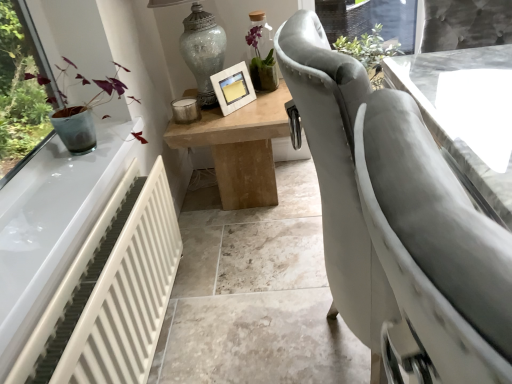
Find the location of a particular element. The width and height of the screenshot is (512, 384). white glossy table at center, positioned as the 2th table in left-to-right order is located at coordinates (447, 135).

What do you see at coordinates (233, 88) in the screenshot? The height and width of the screenshot is (384, 512). I see `white textured picture frame at center` at bounding box center [233, 88].

This screenshot has height=384, width=512. Describe the element at coordinates (203, 51) in the screenshot. I see `crackle glass vase at upper center` at that location.

What is the approximate height of crackle glass vase at upper center?

crackle glass vase at upper center is 20.92 inches in height.

At what (x,y) coordinates should I click in order to perform the action: click on light brown wooden table at center, which is the first table from left to right. Please return your answer as a coordinate pair (x, y). Looking at the image, I should click on (240, 147).

Could you tell me if white glossy table at center, positioned as the 2th table in left-to-right order, is facing crackle glass vase at upper center?

No, white glossy table at center, positioned as the 2th table in left-to-right order, is not oriented towards crackle glass vase at upper center.

Which object is closer to the camera, white glossy table at center, arranged as the first table when viewed from the right, or crackle glass vase at upper center?

white glossy table at center, arranged as the first table when viewed from the right.

Which of these two, white glossy table at center, positioned as the 2th table in left-to-right order, or crackle glass vase at upper center, is smaller?

With smaller size is crackle glass vase at upper center.

Based on the photo, from a real-world perspective, which is physically below, white glossy table at center, positioned as the 2th table in left-to-right order, or crackle glass vase at upper center?

white glossy table at center, positioned as the 2th table in left-to-right order, from a real-world perspective.

From the picture: Is the position of white glossy table at center, positioned as the 2th table in left-to-right order, more distant than that of white textured picture frame at center?

No.

Which of these two, white glossy table at center, positioned as the 2th table in left-to-right order, or white textured picture frame at center, is thinner?

white textured picture frame at center is thinner.

Is point (454, 152) positioned behind point (245, 74)?

That is False.

From the image's perspective, is white glossy table at center, positioned as the 2th table in left-to-right order, positioned above or below white textured picture frame at center?

white glossy table at center, positioned as the 2th table in left-to-right order, is situated lower than white textured picture frame at center in the image.

In the scene shown: From a real-world perspective, is white glossy table at center, positioned as the 2th table in left-to-right order, above or below white matte radiator at lower left?

Clearly, from a real-world perspective, white glossy table at center, positioned as the 2th table in left-to-right order, is above white matte radiator at lower left.

The image size is (512, 384). In order to click on radiator directly beneath the white glossy table at center, arranged as the first table when viewed from the right (from a real-world perspective) in this screenshot , I will do `click(111, 294)`.

Looking at this image, is white glossy table at center, positioned as the 2th table in left-to-right order, turned away from white matte radiator at lower left?

No, white glossy table at center, positioned as the 2th table in left-to-right order, is not facing the opposite direction of white matte radiator at lower left.

Is white glossy table at center, positioned as the 2th table in left-to-right order, directly adjacent to white matte radiator at lower left?

No, white glossy table at center, positioned as the 2th table in left-to-right order, is not beside white matte radiator at lower left.

Considering the relative positions of white textured picture frame at center and light brown wooden table at center, which is the first table from left to right, in the image provided, is white textured picture frame at center to the left or to the right of light brown wooden table at center, which is the first table from left to right,?

Clearly, white textured picture frame at center is on the left of light brown wooden table at center, which is the first table from left to right, in the image.

Does white textured picture frame at center contain light brown wooden table at center, which is the first table from left to right?

No, light brown wooden table at center, which is the first table from left to right, is not a part of white textured picture frame at center.

Does point (255, 94) come in front of point (217, 107)?

No, (255, 94) is further to viewer.

Is white matte radiator at lower left not within white textured picture frame at center?

Indeed, white matte radiator at lower left is completely outside white textured picture frame at center.

Locate an element on the screen. This screenshot has height=384, width=512. picture frame that is above the white matte radiator at lower left (from the image's perspective) is located at coordinates (233, 88).

Is white matte radiator at lower left further to the viewer compared to white textured picture frame at center?

No, white matte radiator at lower left is closer to the viewer.

In terms of size, does white matte radiator at lower left appear bigger or smaller than white textured picture frame at center?

Clearly, white matte radiator at lower left is larger in size than white textured picture frame at center.

How many degrees apart are the facing directions of white textured picture frame at center and crackle glass vase at upper center?

36 degrees separate the facing orientations of white textured picture frame at center and crackle glass vase at upper center.

From a real-world perspective, between white textured picture frame at center and crackle glass vase at upper center, who is vertically lower?

white textured picture frame at center.

How much distance is there between white textured picture frame at center and crackle glass vase at upper center?

white textured picture frame at center is 5.31 inches away from crackle glass vase at upper center.

Is white textured picture frame at center looking in the opposite direction of crackle glass vase at upper center?

Yes.

In terms of height, does white glossy table at center, positioned as the 2th table in left-to-right order, look taller or shorter compared to light brown wooden table at center, which is the first table from left to right?

Considering their sizes, white glossy table at center, positioned as the 2th table in left-to-right order, has more height than light brown wooden table at center, which is the first table from left to right.

From a real-world perspective, who is located lower, white glossy table at center, positioned as the 2th table in left-to-right order, or light brown wooden table at center, which is the first table from left to right?

From a 3D spatial view, light brown wooden table at center, which is the first table from left to right, is below.

Can you confirm if white glossy table at center, positioned as the 2th table in left-to-right order, is bigger than light brown wooden table at center, placed as the 2th table when sorted from right to left?

Yes.

Does white glossy table at center, arranged as the first table when viewed from the right, have a greater width compared to light brown wooden table at center, which is the first table from left to right?

Yes.

From a real-world perspective, which table is the 1st one underneath the crackle glass vase at upper center? Please provide its 2D coordinates.

[(447, 135)]

The height and width of the screenshot is (384, 512). What are the coordinates of `picture frame that is on the left side of white glossy table at center, positioned as the 2th table in left-to-right order` in the screenshot? It's located at (233, 88).

Based on their spatial positions, is white textured picture frame at center or crackle glass vase at upper center further from light brown wooden table at center, placed as the 2th table when sorted from right to left?

crackle glass vase at upper center.

Which object lies further to the anchor point white matte radiator at lower left, white textured picture frame at center or white glossy table at center, arranged as the first table when viewed from the right?

white glossy table at center, arranged as the first table when viewed from the right, is positioned further to the anchor white matte radiator at lower left.

When comparing their distances from light brown wooden table at center, which is the first table from left to right, does crackle glass vase at upper center or white textured picture frame at center seem further?

Based on the image, crackle glass vase at upper center appears to be further to light brown wooden table at center, which is the first table from left to right.

In the scene shown: When comparing their distances from white matte radiator at lower left, does light brown wooden table at center, placed as the 2th table when sorted from right to left, or white glossy table at center, positioned as the 2th table in left-to-right order, seem further?

Among the two, white glossy table at center, positioned as the 2th table in left-to-right order, is located further to white matte radiator at lower left.

When comparing their distances from crackle glass vase at upper center, does white matte radiator at lower left or white textured picture frame at center seem further?

Among the two, white matte radiator at lower left is located further to crackle glass vase at upper center.

Based on the photo, considering their positions, is white textured picture frame at center positioned further to white glossy table at center, arranged as the first table when viewed from the right, than light brown wooden table at center, placed as the 2th table when sorted from right to left?

The object further to white glossy table at center, arranged as the first table when viewed from the right, is white textured picture frame at center.

When comparing their distances from crackle glass vase at upper center, does white textured picture frame at center or light brown wooden table at center, which is the first table from left to right, seem further?

light brown wooden table at center, which is the first table from left to right, lies further to crackle glass vase at upper center than the other object.

Estimate the real-world distances between objects in this image. Which object is closer to light brown wooden table at center, which is the first table from left to right, white matte radiator at lower left or crackle glass vase at upper center?

Among the two, crackle glass vase at upper center is located nearer to light brown wooden table at center, which is the first table from left to right.

I want to click on picture frame situated between white matte radiator at lower left and white glossy table at center, positioned as the 2th table in left-to-right order, from left to right, so click(x=233, y=88).

Locate an element on the screen. table between white textured picture frame at center and white glossy table at center, arranged as the first table when viewed from the right is located at coordinates (240, 147).

The image size is (512, 384). Identify the location of picture frame situated between crackle glass vase at upper center and white glossy table at center, arranged as the first table when viewed from the right, from left to right. (233, 88).

I want to click on table located between white matte radiator at lower left and white glossy table at center, positioned as the 2th table in left-to-right order, in the left-right direction, so click(x=240, y=147).